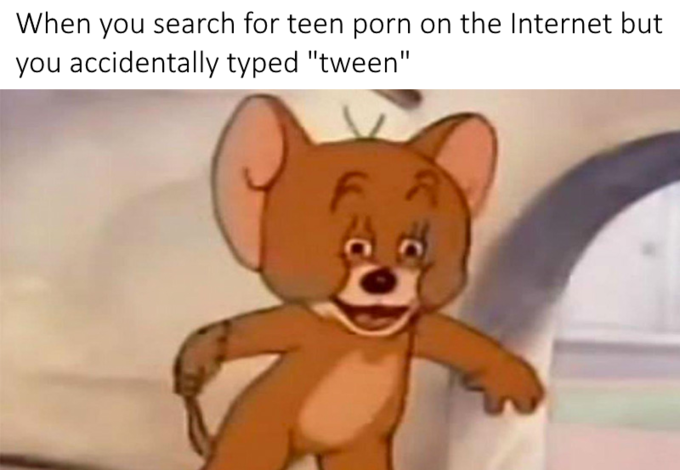
Locate an element on the screen. mouse hole is located at coordinates (600, 196).